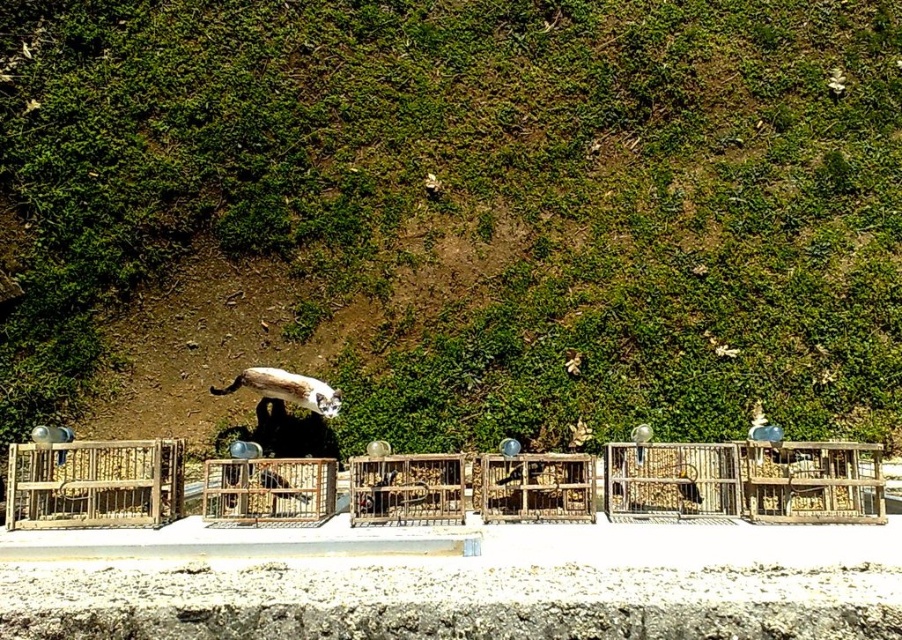
Is wooden birdcage at left closer to camera compared to wooden birdcage at center?

Yes, wooden birdcage at left is closer to the viewer.

Can you confirm if wooden birdcage at left is smaller than wooden birdcage at center?

Incorrect, wooden birdcage at left is not smaller in size than wooden birdcage at center.

Who is more distant from viewer, (34, 499) or (647, 500)?

The point (647, 500) is more distant.

Identify the location of wooden birdcage at left. The width and height of the screenshot is (902, 640). (94, 483).

Who is higher up, wooden birdcages at center or wooden birdcage at left?

wooden birdcages at center is above.

The height and width of the screenshot is (640, 902). What do you see at coordinates (747, 481) in the screenshot?
I see `wooden birdcages at center` at bounding box center [747, 481].

Where is `wooden birdcages at center`? Image resolution: width=902 pixels, height=640 pixels. wooden birdcages at center is located at coordinates (747, 481).

In the scene shown: Does wooden birdcages at center appear on the right side of wooden birdcage at center?

Yes, wooden birdcages at center is to the right of wooden birdcage at center.

Between wooden birdcages at center and wooden birdcage at center, which one has less height?

Standing shorter between the two is wooden birdcages at center.

Who is more distant from viewer, (320, 497) or (695, 451)?

Point (695, 451)

Where is `wooden birdcages at center`? wooden birdcages at center is located at coordinates (747, 481).